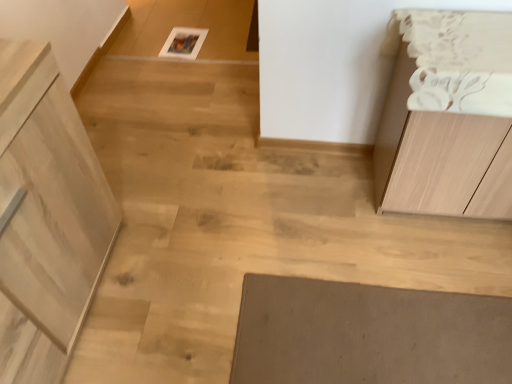
At what (x,y) coordinates should I click in order to perform the action: click on vacant space that is in between light wood cabinet at left, which is the 1th cabinetry from left to right, and light wood cabinet at right, the 1th cabinetry in the right-to-left sequence. Please return your answer as a coordinate pair (x, y). Looking at the image, I should click on (274, 258).